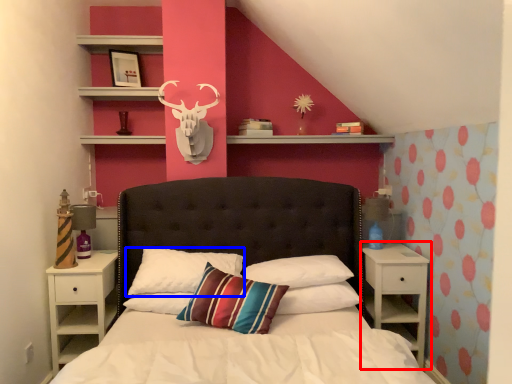
Question: Among these objects, which one is farthest to the camera, nightstand (highlighted by a red box) or pillow (highlighted by a blue box)?

Choices:
 (A) nightstand
 (B) pillow

Answer: (A)